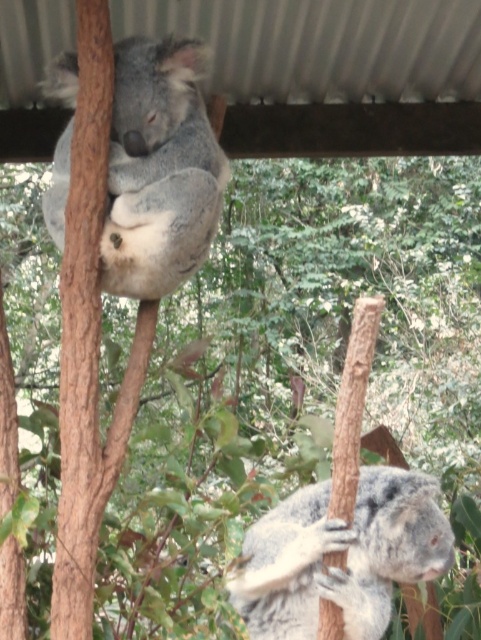
Looking at this image, you are a zookeeper observing the koalas in their enclosure. There is a gray furry koala at upper center and another koala not mentioned in the objects. Based on their positions, which koala is closer to the top edge of the enclosure?

The gray furry koala at upper center is closer to the top edge of the enclosure because its position at point (160,170) places it higher up compared to the other koala not listed in the objects.